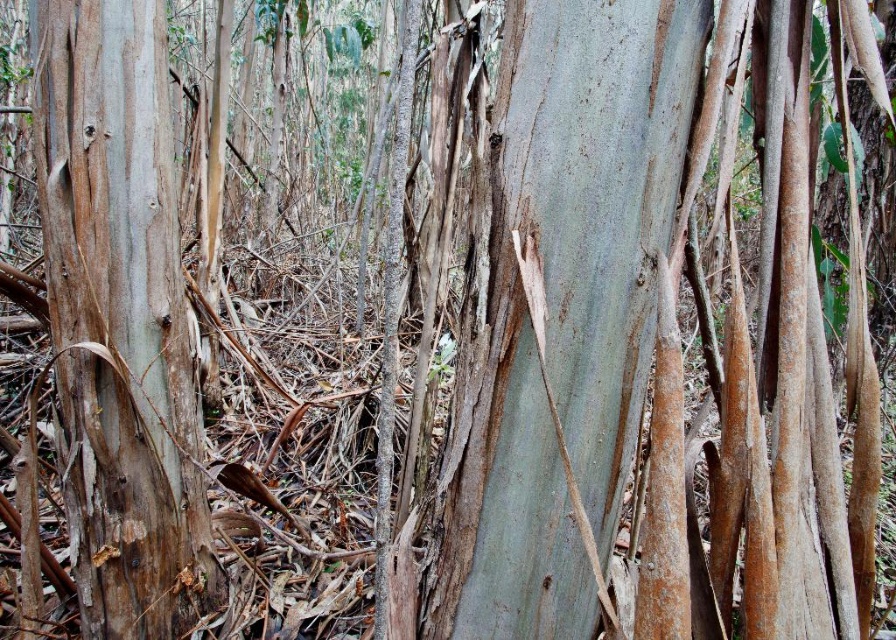
In the scene shown: You are a botanist examining two tree trunks in a eucalyptus forest. You see the smooth gray bark at center and the smooth brown bark at left. Which bark is located higher up in the image?

The smooth gray bark at center is positioned over the smooth brown bark at left, so it is higher up in the image.

Consider the image. You are standing in a dense forest of eucalyptus trees. You notice a specific point at coordinates (560, 308). Based on the scene, what does this point most likely represent?

The point at coordinates (560, 308) most likely represents the smooth gray bark at center, as the description states that this point indicates that specific feature.